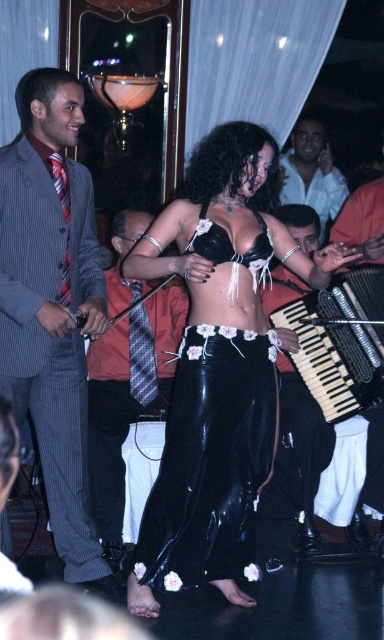
You are a photographer at the event and want to capture both the striped fabric suit at left and the black satin bikini top at center in a single frame. Since you can adjust your camera angle, which object should you focus on first to ensure both are in the frame?

The striped fabric suit at left is much taller than the black satin bikini top at center, so you should focus on the striped fabric suit at left first to ensure both are in the frame.

Based on the scene description and the coordinates provided, what object is located at the point with coordinates (311, 173)?

The point at coordinates (311, 173) indicates the light blue shirt at center.